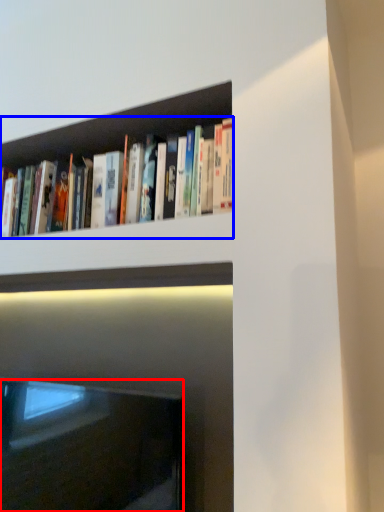
Question: Which object is closer to the camera taking this photo, fireplace (highlighted by a red box) or book (highlighted by a blue box)?

Choices:
 (A) fireplace
 (B) book

Answer: (B)